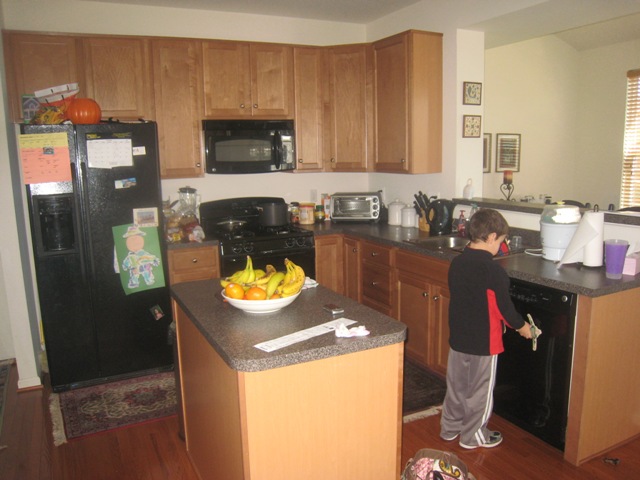
Locate an element on the screen. counter top is located at coordinates (379, 226), (532, 270), (251, 327).